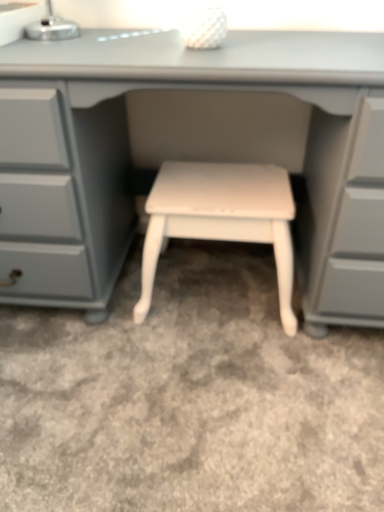
Question: Is matte gray desk at center directly adjacent to white painted wood stool at center?

Choices:
 (A) no
 (B) yes

Answer: (A)

Question: Can we say matte gray desk at center lies outside white painted wood stool at center?

Choices:
 (A) yes
 (B) no

Answer: (A)

Question: Considering the relative sizes of matte gray desk at center and white painted wood stool at center in the image provided, is matte gray desk at center wider than white painted wood stool at center?

Choices:
 (A) no
 (B) yes

Answer: (B)

Question: From the image's perspective, is matte gray desk at center below white painted wood stool at center?

Choices:
 (A) no
 (B) yes

Answer: (A)

Question: From a real-world perspective, is matte gray desk at center physically below white painted wood stool at center?

Choices:
 (A) no
 (B) yes

Answer: (A)

Question: Can you confirm if matte gray desk at center is thinner than white painted wood stool at center?

Choices:
 (A) no
 (B) yes

Answer: (A)

Question: Is white painted wood stool at center completely or partially outside of matte gray desk at center?

Choices:
 (A) no
 (B) yes

Answer: (A)

Question: From the image's perspective, is white painted wood stool at center beneath matte gray desk at center?

Choices:
 (A) no
 (B) yes

Answer: (B)

Question: Considering the relative sizes of white painted wood stool at center and matte gray desk at center in the image provided, is white painted wood stool at center taller than matte gray desk at center?

Choices:
 (A) no
 (B) yes

Answer: (A)

Question: From the image's perspective, is white painted wood stool at center above matte gray desk at center?

Choices:
 (A) yes
 (B) no

Answer: (B)

Question: From a real-world perspective, is white painted wood stool at center physically above matte gray desk at center?

Choices:
 (A) no
 (B) yes

Answer: (A)

Question: Is white painted wood stool at center smaller than matte gray desk at center?

Choices:
 (A) yes
 (B) no

Answer: (A)

Question: In terms of height, does matte gray desk at center look taller or shorter compared to white painted wood stool at center?

Choices:
 (A) short
 (B) tall

Answer: (B)